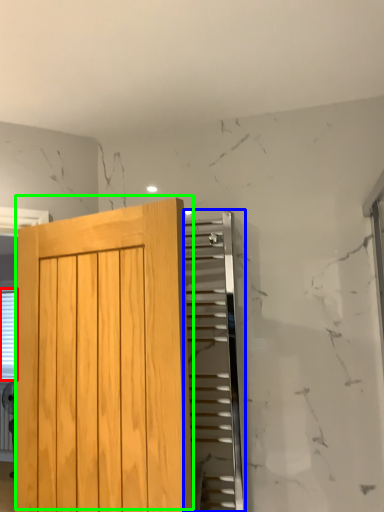
Question: Estimate the real-world distances between objects in this image. Which object is closer to blind (highlighted by a red box), elevator (highlighted by a blue box) or door (highlighted by a green box)?

Choices:
 (A) elevator
 (B) door

Answer: (B)